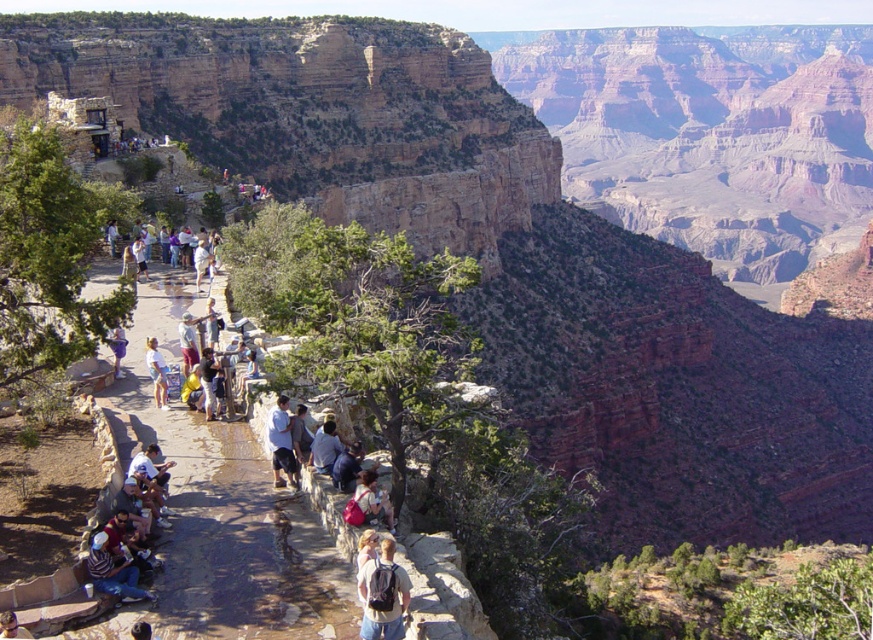
In the scene shown: You are a photographer planning to capture a candid shot of the light brown leather jacket at lower left and the light blue denim shorts at lower left. Since you want to ensure both are in focus, you need to know their relative sizes. Which object is smaller?

The light brown leather jacket at lower left is smaller compared to the light blue denim shorts at lower left according to the description.

You are a hiker planning to walk from the light brown leather jacket at lower left to the matte gray backpack at center. Which direction should you move to reach the backpack?

The matte gray backpack at center is to the right of the light brown leather jacket at lower left. To reach the backpack, move towards the right direction from the jacket.

From the picture: You are standing at the overlook and want to take a photo that includes both the point at coordinates point (287, 429) and the point at coordinates point (156, 358). Which point should you focus on first to ensure both are in clear view?

You should focus on point (287, 429) first because it is closer to the camera than point (156, 358), ensuring both are in focus when using depth of field.